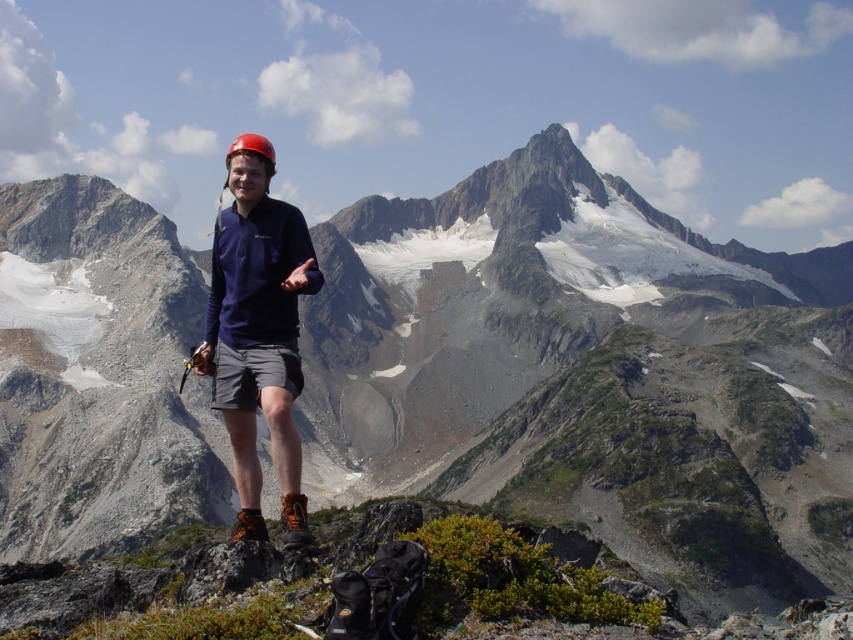
Who is taller, matte blue shirt at center or gray fabric shorts at center?

matte blue shirt at center

Does point (281, 436) lie behind point (300, 371)?

No, (281, 436) is in front of (300, 371).

The height and width of the screenshot is (640, 853). I want to click on matte blue shirt at center, so click(x=258, y=332).